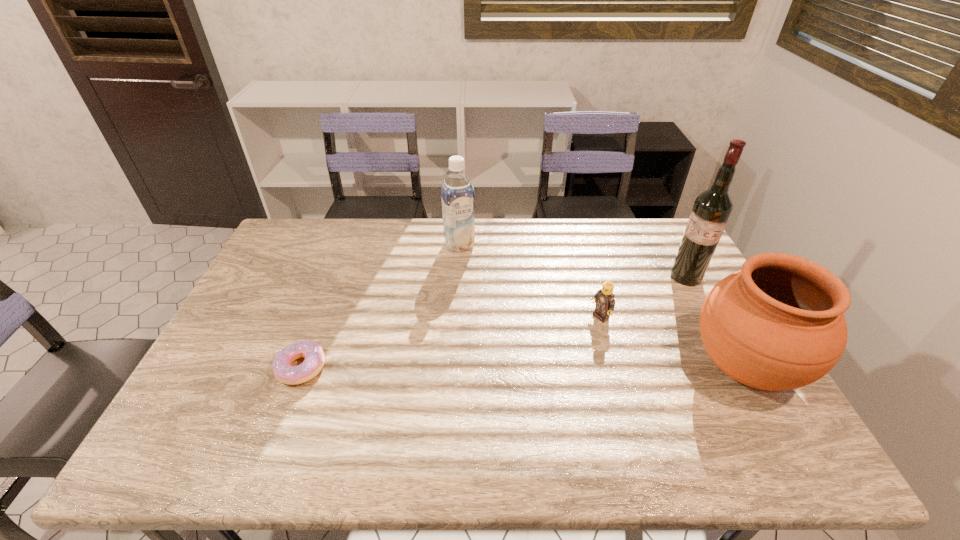
Where is `the leftmost object`? This screenshot has height=540, width=960. the leftmost object is located at coordinates (313, 353).

The image size is (960, 540). In order to click on doughnut in this screenshot , I will do `click(313, 353)`.

Find the location of a particular element. This screenshot has height=540, width=960. pottery is located at coordinates [777, 324].

The height and width of the screenshot is (540, 960). What are the coordinates of `the fourth object from right to left` in the screenshot? It's located at (457, 193).

I want to click on soya milk, so click(457, 193).

This screenshot has height=540, width=960. What are the coordinates of `the third object from left to right` in the screenshot? It's located at (604, 298).

Identify the location of Lego. This screenshot has height=540, width=960. (604, 298).

The height and width of the screenshot is (540, 960). In order to click on wine bottle in this screenshot , I will do `click(711, 211)`.

Locate an element on the screen. the second farthest object is located at coordinates [x=711, y=211].

Where is `blank area located on the left of the doughnut`? Image resolution: width=960 pixels, height=540 pixels. blank area located on the left of the doughnut is located at coordinates (246, 367).